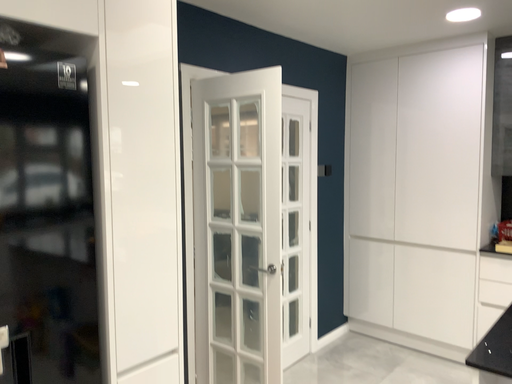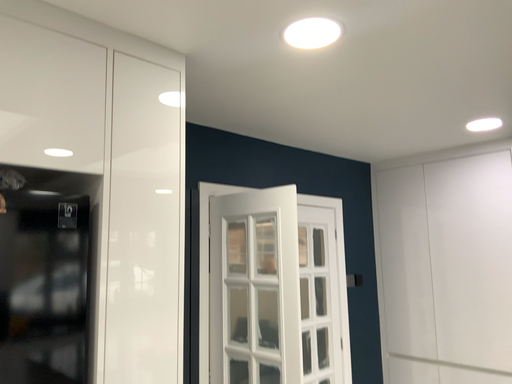
Question: Which way did the camera rotate in the video?

Choices:
 (A) rotated downward
 (B) rotated upward

Answer: (B)